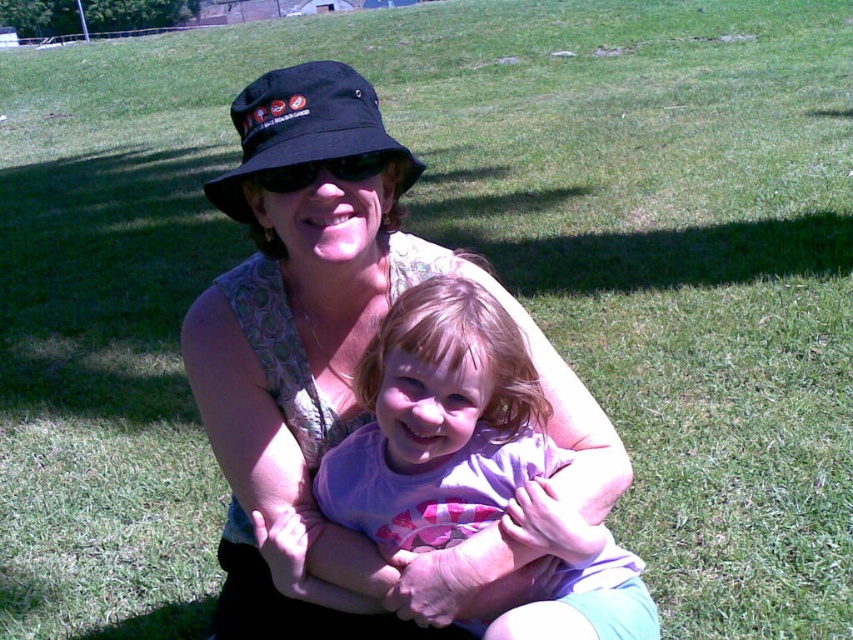
Between purple cotton shirt at center and black fabric hat at upper center, which one appears on the right side from the viewer's perspective?

purple cotton shirt at center

Does purple cotton shirt at center have a greater width compared to black fabric hat at upper center?

Yes, purple cotton shirt at center is wider than black fabric hat at upper center.

Which is in front, point (576, 579) or point (299, 138)?

Positioned in front is point (299, 138).

Identify the location of purple cotton shirt at center. This screenshot has height=640, width=853. (457, 440).